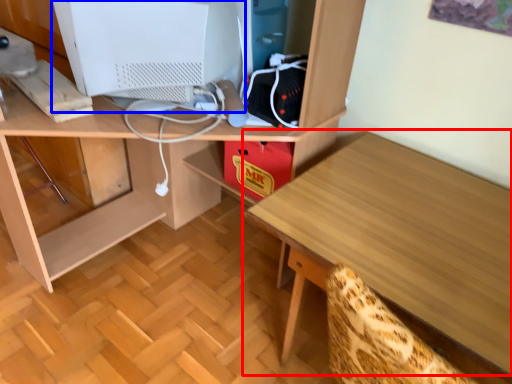
Question: Which point is further to the camera, table (highlighted by a red box) or computer monitor (highlighted by a blue box)?

Choices:
 (A) table
 (B) computer monitor

Answer: (B)